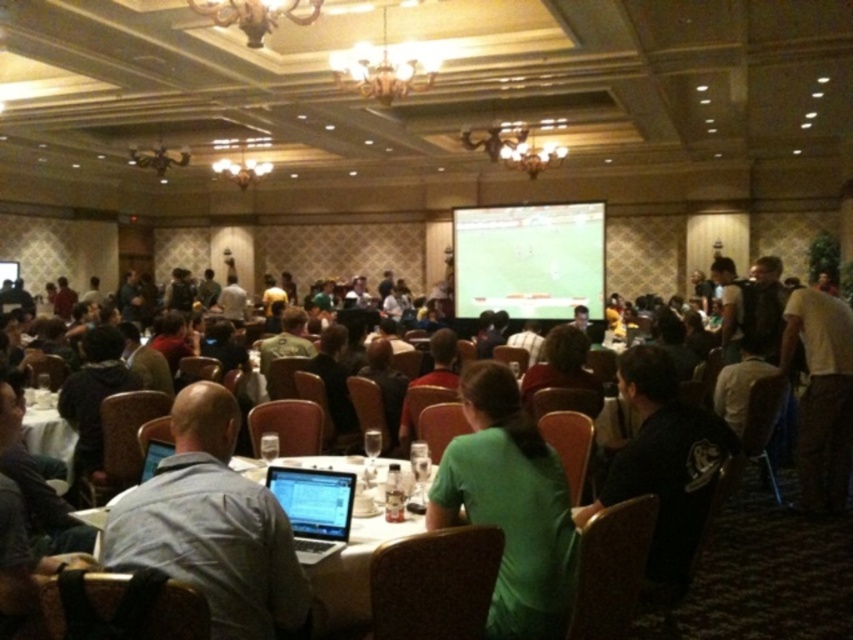
Question: Where is green matte projection screen at center located in relation to white cotton shirt at center in the image?

Choices:
 (A) above
 (B) below

Answer: (A)

Question: Which point appears farthest from the camera in this image?

Choices:
 (A) (630, 477)
 (B) (833, 346)
 (C) (293, 541)
 (D) (572, 291)

Answer: (D)

Question: From the image, what is the correct spatial relationship of gray fabric shirt at center in relation to green matte shirt at center?

Choices:
 (A) above
 (B) below

Answer: (B)

Question: Which of these objects is positioned farthest from the white glossy table at center?

Choices:
 (A) white cotton shirt at center
 (B) black jersey at center
 (C) black glossy laptop at center
 (D) gray fabric shirt at center

Answer: (A)

Question: Is green matte projection screen at center to the right of white cotton shirt at center from the viewer's perspective?

Choices:
 (A) yes
 (B) no

Answer: (B)

Question: Which point appears closest to the camera in this image?

Choices:
 (A) (624, 355)
 (B) (514, 429)

Answer: (B)